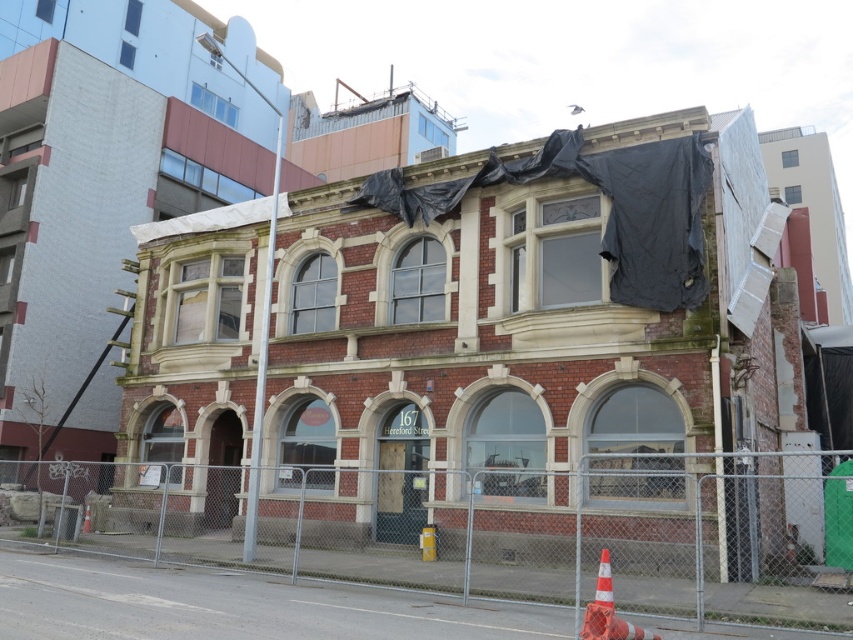
You are standing in front of the Victorian building and notice two points marked on its facade. The first point is located at coordinates point (512, 568) and the second at point (589, 624). From your current position, which point is closer to you?

Point (589, 624) is closer to you because it is in front of point (512, 568).